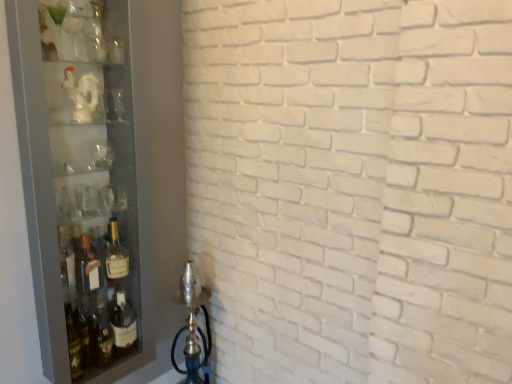
Image resolution: width=512 pixels, height=384 pixels. Identify the location of white glossy statue at upper left. (74, 93).

Where is `matte glass bottle at left`? The height and width of the screenshot is (384, 512). matte glass bottle at left is located at coordinates (116, 258).

At what (x,y) coordinates should I click in order to perform the action: click on white glossy statue at upper left. Please return your answer as a coordinate pair (x, y). Looking at the image, I should click on (74, 93).

Can you tell me how much transparent glass cabinet at left and matte glass bottle at left differ in facing direction?

0.0039 degrees separate the facing orientations of transparent glass cabinet at left and matte glass bottle at left.

I want to click on bottle below the transparent glass cabinet at left (from a real-world perspective), so click(116, 258).

Does point (9, 1) lie behind point (109, 251)?

No, it is in front of (109, 251).

Which object is further away from the camera taking this photo, transparent glass cabinet at left or white glossy statue at upper left?

white glossy statue at upper left is behind.

Considering the sizes of transparent glass cabinet at left and white glossy statue at upper left in the image, is transparent glass cabinet at left bigger or smaller than white glossy statue at upper left?

Considering their sizes, transparent glass cabinet at left takes up more space than white glossy statue at upper left.

In the scene shown: Is transparent glass cabinet at left positioned with its back to white glossy statue at upper left?

That's right, transparent glass cabinet at left is facing away from white glossy statue at upper left.

Is transparent glass cabinet at left situated inside white glossy statue at upper left or outside?

transparent glass cabinet at left cannot be found inside white glossy statue at upper left.

Which is in front, matte glass bottle at left or transparent glass cabinet at left?

transparent glass cabinet at left is more forward.

How distant is matte glass bottle at left from transparent glass cabinet at left?

11.53 inches.

Considering the positions of points (128, 272) and (53, 13), is point (128, 272) farther from camera compared to point (53, 13)?

Yes, point (128, 272) is behind point (53, 13).

Which of these two, matte glass bottle at left or transparent glass cabinet at left, is smaller?

Smaller between the two is matte glass bottle at left.

How far apart are white glossy statue at upper left and transparent glass cabinet at left?

A distance of 25.32 centimeters exists between white glossy statue at upper left and transparent glass cabinet at left.

Is white glossy statue at upper left wider or thinner than transparent glass cabinet at left?

Considering their sizes, white glossy statue at upper left looks slimmer than transparent glass cabinet at left.

Between white glossy statue at upper left and transparent glass cabinet at left, which one appears on the right side from the viewer's perspective?

transparent glass cabinet at left.

Is white glossy statue at upper left bigger or smaller than transparent glass cabinet at left?

Clearly, white glossy statue at upper left is smaller in size than transparent glass cabinet at left.

Looking at this image, is white glossy statue at upper left completely or partially inside matte glass bottle at left?

No, white glossy statue at upper left is not surrounded by matte glass bottle at left.

Is matte glass bottle at left facing away from white glossy statue at upper left?

No, matte glass bottle at left is not facing away from white glossy statue at upper left.

Based on the photo, from a real-world perspective, is matte glass bottle at left located higher than white glossy statue at upper left?

Actually, matte glass bottle at left is physically below white glossy statue at upper left in the real world.

Who is taller, matte glass bottle at left or white glossy statue at upper left?

matte glass bottle at left.

Which object is wider, white glossy statue at upper left or matte glass bottle at left?

Wider between the two is matte glass bottle at left.

From the image's perspective, is white glossy statue at upper left below matte glass bottle at left?

No, from the image's perspective, white glossy statue at upper left is not beneath matte glass bottle at left.

Who is taller, white glossy statue at upper left or matte glass bottle at left?

With more height is matte glass bottle at left.

The width and height of the screenshot is (512, 384). I want to click on bottle beneath the transparent glass cabinet at left (from a real-world perspective), so click(x=116, y=258).

I want to click on shelf that appears above the transparent glass cabinet at left (from the image's perspective), so click(x=74, y=93).

Which object lies further to the anchor point matte glass bottle at left, white glossy statue at upper left or transparent glass cabinet at left?

white glossy statue at upper left.

When comparing their distances from matte glass bottle at left, does transparent glass cabinet at left or white glossy statue at upper left seem closer?

Among the two, transparent glass cabinet at left is located nearer to matte glass bottle at left.

Considering their positions, is matte glass bottle at left positioned closer to transparent glass cabinet at left than white glossy statue at upper left?

The object closer to transparent glass cabinet at left is white glossy statue at upper left.

Looking at this image, based on their spatial positions, is transparent glass cabinet at left or matte glass bottle at left further from white glossy statue at upper left?

matte glass bottle at left.

Considering their positions, is matte glass bottle at left positioned further to white glossy statue at upper left than transparent glass cabinet at left?

matte glass bottle at left lies further to white glossy statue at upper left than the other object.

Considering their positions, is white glossy statue at upper left positioned further to transparent glass cabinet at left than matte glass bottle at left?

The object further to transparent glass cabinet at left is matte glass bottle at left.

Image resolution: width=512 pixels, height=384 pixels. I want to click on glass door that lies between white glossy statue at upper left and matte glass bottle at left from top to bottom, so (x=83, y=181).